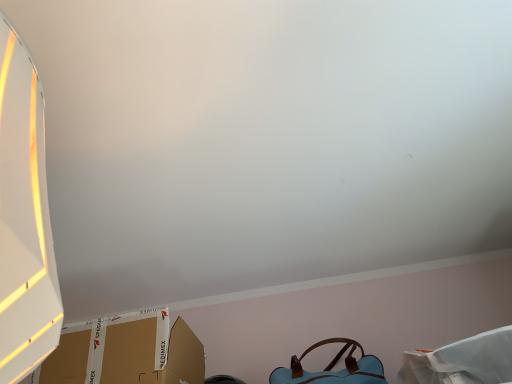
Question: From a real-world perspective, is light blue leather handbag at lower right under brown cardboard box at lower left?

Choices:
 (A) no
 (B) yes

Answer: (A)

Question: Is light blue leather handbag at lower right positioned far away from brown cardboard box at lower left?

Choices:
 (A) no
 (B) yes

Answer: (A)

Question: Is light blue leather handbag at lower right closer to camera compared to brown cardboard box at lower left?

Choices:
 (A) no
 (B) yes

Answer: (A)

Question: From the image's perspective, is light blue leather handbag at lower right located beneath brown cardboard box at lower left?

Choices:
 (A) yes
 (B) no

Answer: (A)

Question: Is light blue leather handbag at lower right outside of brown cardboard box at lower left?

Choices:
 (A) yes
 (B) no

Answer: (A)

Question: Is light blue leather handbag at lower right wider than brown cardboard box at lower left?

Choices:
 (A) no
 (B) yes

Answer: (A)

Question: Is brown cardboard box at lower left shorter than light blue leather handbag at lower right?

Choices:
 (A) no
 (B) yes

Answer: (A)

Question: Is brown cardboard box at lower left closer to camera compared to light blue leather handbag at lower right?

Choices:
 (A) no
 (B) yes

Answer: (B)

Question: From the image's perspective, would you say brown cardboard box at lower left is positioned over light blue leather handbag at lower right?

Choices:
 (A) no
 (B) yes

Answer: (B)

Question: Could you tell me if brown cardboard box at lower left is facing light blue leather handbag at lower right?

Choices:
 (A) no
 (B) yes

Answer: (A)

Question: From the image's perspective, is brown cardboard box at lower left located beneath light blue leather handbag at lower right?

Choices:
 (A) yes
 (B) no

Answer: (B)

Question: Can you confirm if brown cardboard box at lower left is thinner than light blue leather handbag at lower right?

Choices:
 (A) yes
 (B) no

Answer: (B)

Question: Considering their positions, is brown cardboard box at lower left located in front of or behind light blue leather handbag at lower right?

Choices:
 (A) behind
 (B) front

Answer: (B)